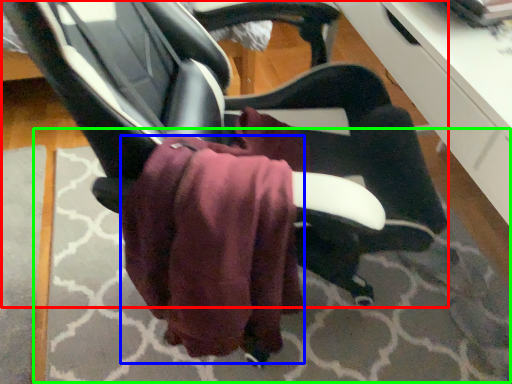
Question: Which object is positioned closest to chair (highlighted by a red box)? Select from bath towel (highlighted by a blue box) and mat (highlighted by a green box).

Choices:
 (A) bath towel
 (B) mat

Answer: (A)